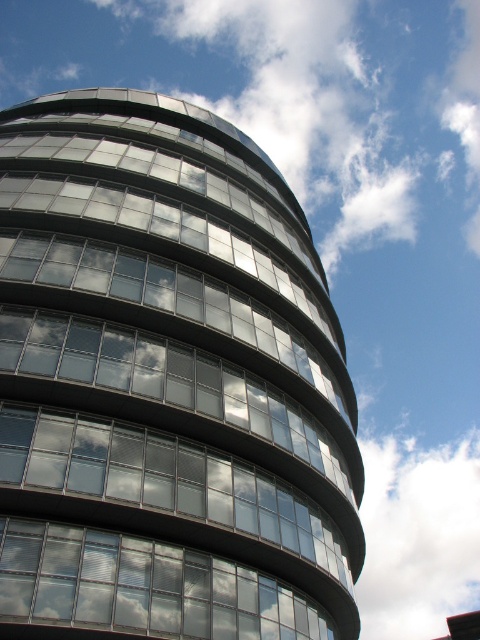
You are a window installer assessing the building from below. You notice a point at coordinates (x=143, y=588). Based on the scene, where is this point located?

The point at coordinates (x=143, y=588) is located on the transparent glass windows at center.